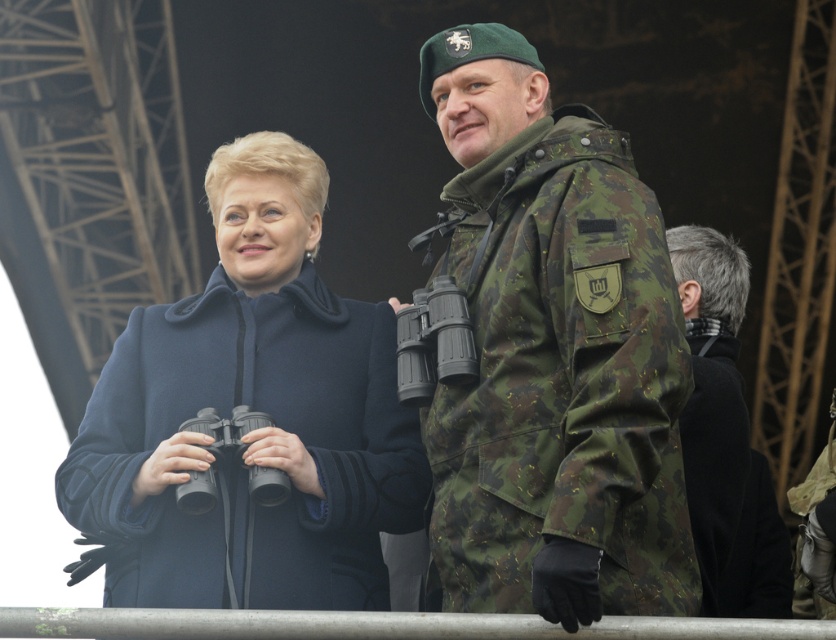
Question: Which object appears farthest from the camera in this image?

Choices:
 (A) dark blue wool coat at center
 (B) camo fabric binoculars at right
 (C) black wool coat at right

Answer: (C)

Question: Observing the image, what is the correct spatial positioning of camo fabric binoculars at right in reference to black wool coat at right?

Choices:
 (A) below
 (B) above

Answer: (B)

Question: Based on their relative distances, which object is nearer to the camo fabric binoculars at right?

Choices:
 (A) black wool coat at right
 (B) dark blue wool coat at center

Answer: (B)

Question: Can you confirm if dark blue wool coat at center is positioned to the left of black wool coat at right?

Choices:
 (A) yes
 (B) no

Answer: (A)

Question: Among these objects, which one is farthest from the camera?

Choices:
 (A) black wool coat at right
 (B) dark blue wool coat at center

Answer: (A)

Question: Does camo fabric binoculars at right have a larger size compared to black wool coat at right?

Choices:
 (A) yes
 (B) no

Answer: (A)